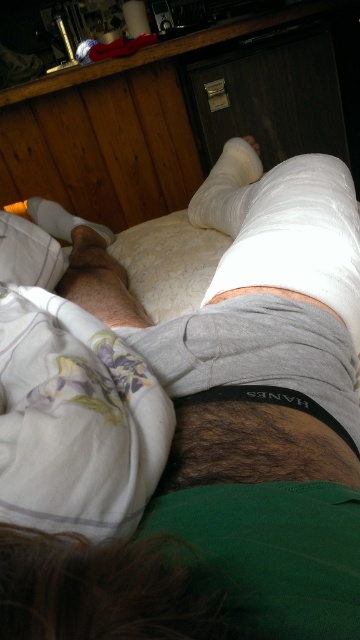
Who is lower down, white cloth bandage at center or white matte bandage at lower left?

Positioned lower is white cloth bandage at center.

Does point (227, 275) come closer to viewer compared to point (47, 227)?

Yes, it is in front of point (47, 227).

Is point (273, 188) positioned behind point (97, 227)?

No, it is in front of (97, 227).

Identify the location of white cloth bandage at center. The width and height of the screenshot is (360, 640). (285, 227).